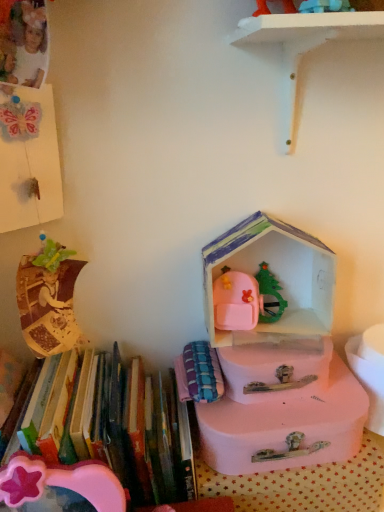
The width and height of the screenshot is (384, 512). I want to click on vacant area on top of pink plastic box at center (from a real-world perspective), so click(283, 332).